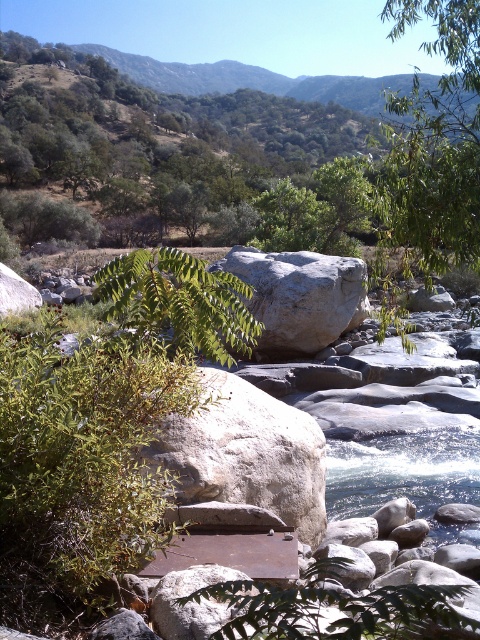
Question: Which of the following is the closest to the observer?

Choices:
 (A) clear water at river center
 (B) green leafy plant at center
 (C) gray rough rock at center

Answer: (B)

Question: Does green leafy tree at upper right appear on the right side of gray rough rock at center?

Choices:
 (A) no
 (B) yes

Answer: (B)

Question: Can you confirm if clear water at river center is smaller than gray rough boulder at center?

Choices:
 (A) no
 (B) yes

Answer: (A)

Question: Does green leafy tree at upper right appear over gray rough rock at center?

Choices:
 (A) yes
 (B) no

Answer: (A)

Question: Which point is farther to the camera?

Choices:
 (A) (297, 476)
 (B) (436, 122)

Answer: (B)

Question: Which of these objects is positioned closest to the gray rough boulder at center?

Choices:
 (A) gray rough rock at center
 (B) green leafy plant at center

Answer: (A)